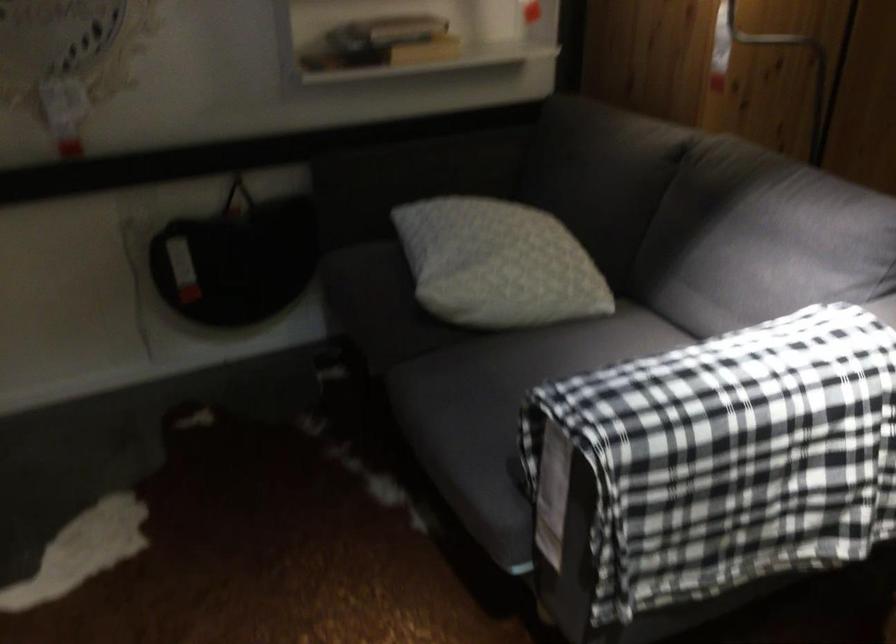
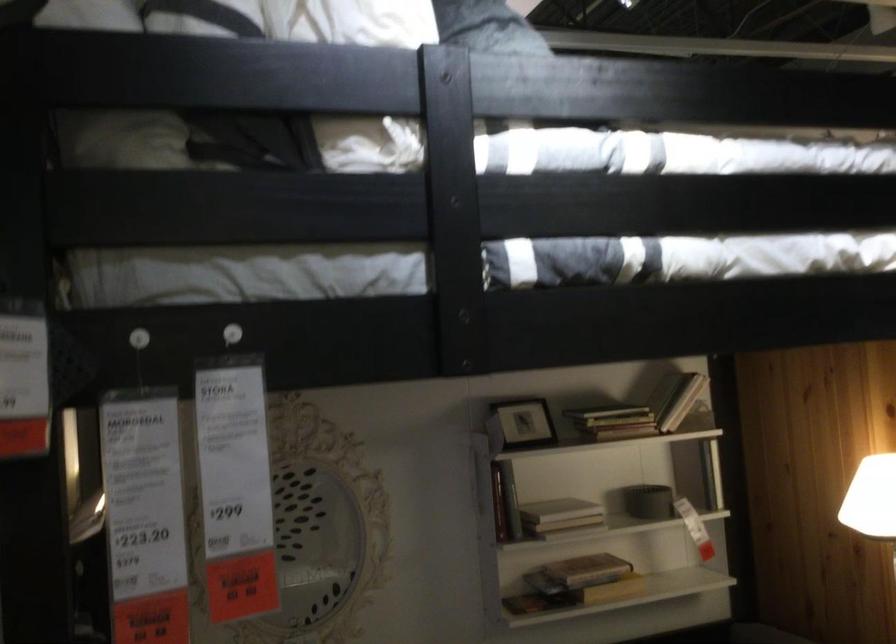
Question: The images are taken continuously from a first-person perspective. In which direction is your viewpoint rotating?

Choices:
 (A) Left
 (B) Right
 (C) Up
 (D) Down

Answer: (C)